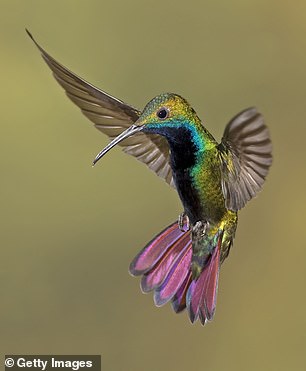
The width and height of the screenshot is (306, 371). Find the location of `chest`. chest is located at coordinates (184, 175).